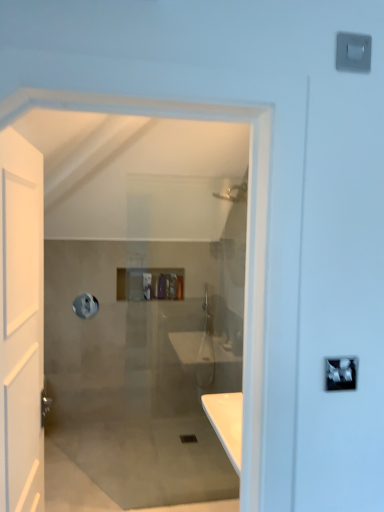
What do you see at coordinates (21, 324) in the screenshot? This screenshot has height=512, width=384. I see `white matte door at left` at bounding box center [21, 324].

At what (x,y) coordinates should I click in order to perform the action: click on white plastic light switch at upper right. Please return your answer as a coordinate pair (x, y). Looking at the image, I should click on (353, 52).

From the picture: What is the approximate width of silver metallic lock at upper right?

3.68 centimeters.

What do you see at coordinates (173, 286) in the screenshot? The image size is (384, 512). I see `translucent plastic toiletries at center` at bounding box center [173, 286].

Find the location of a particular element. The image size is (384, 512). white matte door at left is located at coordinates 21,324.

In the image, there is a white plastic light switch at upper right. Identify the location of toiletry below it (from a real-world perspective). (173, 286).

From the picture: Could you measure the distance between translucent plastic toiletries at center and white plastic light switch at upper right?

translucent plastic toiletries at center is 1.88 meters from white plastic light switch at upper right.

In the scene shown: Between translucent plastic toiletries at center and white plastic light switch at upper right, which one has larger size?

With larger size is translucent plastic toiletries at center.

Does translucent plastic toiletries at center appear on the left side of white plastic light switch at upper right?

Yes, translucent plastic toiletries at center is to the left of white plastic light switch at upper right.

Is point (356, 50) positioned in front of point (171, 277)?

Yes, point (356, 50) is closer to viewer.

Is white plastic light switch at upper right positioned in front of translucent plastic toiletries at center?

Yes, the depth of white plastic light switch at upper right is less than that of translucent plastic toiletries at center.

Does white plastic light switch at upper right have a lesser height compared to translucent plastic toiletries at center?

Result: Indeed, white plastic light switch at upper right has a lesser height compared to translucent plastic toiletries at center.

Is white plastic light switch at upper right bigger than translucent plastic toiletries at center?

Actually, white plastic light switch at upper right might be smaller than translucent plastic toiletries at center.

Considering the relative sizes of white plastic light switch at upper right and silver metallic lock at upper right in the image provided, is white plastic light switch at upper right taller than silver metallic lock at upper right?

In fact, white plastic light switch at upper right may be shorter than silver metallic lock at upper right.

Do you think white plastic light switch at upper right is within silver metallic lock at upper right, or outside of it?

white plastic light switch at upper right lies outside silver metallic lock at upper right.

Can you tell me how much white plastic light switch at upper right and silver metallic lock at upper right differ in facing direction?

They differ by 0.0241 degrees in their facing directions.

In terms of width, does white plastic light switch at upper right look wider or thinner when compared to silver metallic lock at upper right?

Clearly, white plastic light switch at upper right has less width compared to silver metallic lock at upper right.

In the scene shown: How much distance is there between translucent plastic toiletries at center and silver metallic lock at upper right?

translucent plastic toiletries at center is 2.26 meters away from silver metallic lock at upper right.

From the image's perspective, between translucent plastic toiletries at center and silver metallic lock at upper right, who is located below?

translucent plastic toiletries at center, from the image's perspective.

Is translucent plastic toiletries at center far from silver metallic lock at upper right?

Yes.

Which is behind, point (176, 286) or point (327, 365)?

The point (176, 286) is farther from the camera.

Is silver metallic towel bar at upper left in front of or behind silver metallic lock at upper right in the image?

silver metallic towel bar at upper left is behind silver metallic lock at upper right.

Which is behind, point (92, 298) or point (326, 376)?

The point (92, 298) is more distant.

Can you confirm if silver metallic towel bar at upper left is smaller than silver metallic lock at upper right?

No.

From the image's perspective, between silver metallic towel bar at upper left and silver metallic lock at upper right, which one is located above?

silver metallic lock at upper right, from the image's perspective.

From the image's perspective, relative to translucent plastic toiletries at center, is silver metallic lock at upper right above or below?

Clearly, from the image's perspective, silver metallic lock at upper right is above translucent plastic toiletries at center.

Is silver metallic lock at upper right not near translucent plastic toiletries at center?

silver metallic lock at upper right is positioned a significant distance from translucent plastic toiletries at center.

Locate an element on the screen. lock above the translucent plastic toiletries at center (from a real-world perspective) is located at coordinates (341, 373).

Which object is thinner, silver metallic lock at upper right or translucent plastic toiletries at center?

Thinner between the two is silver metallic lock at upper right.

Do you think white plastic light switch at upper right is within silver metallic towel bar at upper left, or outside of it?

white plastic light switch at upper right lies outside silver metallic towel bar at upper left.

Is white plastic light switch at upper right bigger or smaller than silver metallic towel bar at upper left?

In the image, white plastic light switch at upper right appears to be smaller than silver metallic towel bar at upper left.

Can you see white plastic light switch at upper right touching silver metallic towel bar at upper left?

white plastic light switch at upper right and silver metallic towel bar at upper left are not in contact.

In order to click on towel bar lying on the left of white plastic light switch at upper right in this screenshot , I will do `click(85, 306)`.

Find the location of a particular element. Image resolution: width=384 pixels, height=512 pixels. toiletry located on the left of white plastic light switch at upper right is located at coordinates (173, 286).

At what (x,y) coordinates should I click in order to perform the action: click on light switch in front of the translucent plastic toiletries at center. Please return your answer as a coordinate pair (x, y). Looking at the image, I should click on (353, 52).

Estimate the real-world distances between objects in this image. Which object is further from white matte door at left, translucent plastic toiletries at center or silver metallic towel bar at upper left?

silver metallic towel bar at upper left is further to white matte door at left.

Looking at this image, which object lies further to the anchor point silver metallic lock at upper right, silver metallic towel bar at upper left or translucent plastic toiletries at center?

The object further to silver metallic lock at upper right is silver metallic towel bar at upper left.

Considering their positions, is silver metallic towel bar at upper left positioned closer to translucent plastic toiletries at center than white matte door at left?

silver metallic towel bar at upper left is closer to translucent plastic toiletries at center.

Based on their spatial positions, is silver metallic towel bar at upper left or translucent plastic toiletries at center further from white plastic light switch at upper right?

The object further to white plastic light switch at upper right is silver metallic towel bar at upper left.

From the image, which object appears to be nearer to translucent plastic toiletries at center, white matte door at left or white plastic light switch at upper right?

Among the two, white matte door at left is located nearer to translucent plastic toiletries at center.

Considering their positions, is silver metallic towel bar at upper left positioned further to silver metallic lock at upper right than white matte door at left?

Among the two, silver metallic towel bar at upper left is located further to silver metallic lock at upper right.

Consider the image. Considering their positions, is silver metallic towel bar at upper left positioned closer to white plastic light switch at upper right than white matte door at left?

white matte door at left is closer to white plastic light switch at upper right.

Looking at the image, which one is located closer to silver metallic towel bar at upper left, white plastic light switch at upper right or silver metallic lock at upper right?

Among the two, white plastic light switch at upper right is located nearer to silver metallic towel bar at upper left.

The image size is (384, 512). What are the coordinates of `towel bar between white matte door at left and translucent plastic toiletries at center from front to back` in the screenshot? It's located at (85, 306).

Where is `light switch between white matte door at left and translucent plastic toiletries at center along the z-axis`? light switch between white matte door at left and translucent plastic toiletries at center along the z-axis is located at coordinates (353, 52).

Locate an element on the screen. light switch located between white matte door at left and silver metallic towel bar at upper left in the depth direction is located at coordinates [x=353, y=52].

Where is `lock between white matte door at left and silver metallic towel bar at upper left in the front-back direction`? The width and height of the screenshot is (384, 512). lock between white matte door at left and silver metallic towel bar at upper left in the front-back direction is located at coordinates (341, 373).